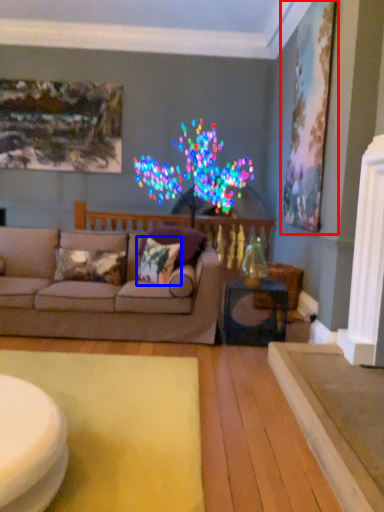
Question: Which point is further to the camera, picture frame (highlighted by a red box) or pillow (highlighted by a blue box)?

Choices:
 (A) picture frame
 (B) pillow

Answer: (A)